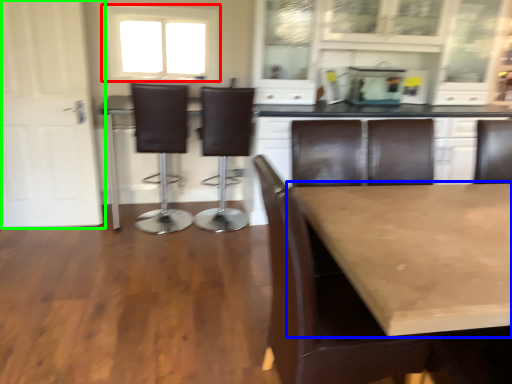
Question: Based on their relative distances, which object is farther from window (highlighted by a red box)? Choose from table (highlighted by a blue box) and door (highlighted by a green box).

Choices:
 (A) table
 (B) door

Answer: (A)